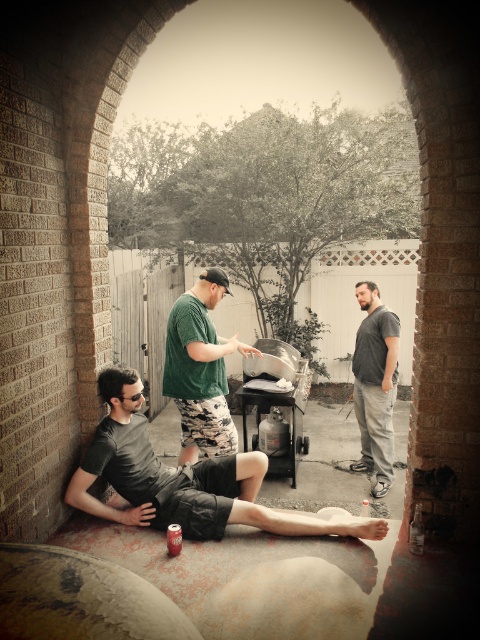
Is point (156, 509) behind point (364, 429)?

No, it is in front of (364, 429).

Who is more forward, (131, 374) or (384, 333)?

Positioned in front is point (131, 374).

At what (x,y) coordinates should I click in order to perform the action: click on dark gray cotton shorts at lower left. Please return your answer as a coordinate pair (x, y). The image size is (480, 640). Looking at the image, I should click on (181, 480).

What are the coordinates of `dark gray cotton shorts at lower left` in the screenshot? It's located at (181, 480).

Which is in front, point (205, 529) or point (210, 348)?

Point (205, 529) is in front.

Does point (256, 506) lie behind point (180, 406)?

No, (256, 506) is in front of (180, 406).

At what (x,y) coordinates should I click in order to perform the action: click on dark gray cotton shorts at lower left. Please return your answer as a coordinate pair (x, y). Image resolution: width=480 pixels, height=640 pixels. Looking at the image, I should click on (181, 480).

Is point (222, 451) closer to camera compared to point (387, 472)?

Yes.

I want to click on green matte shirt at center, so click(201, 369).